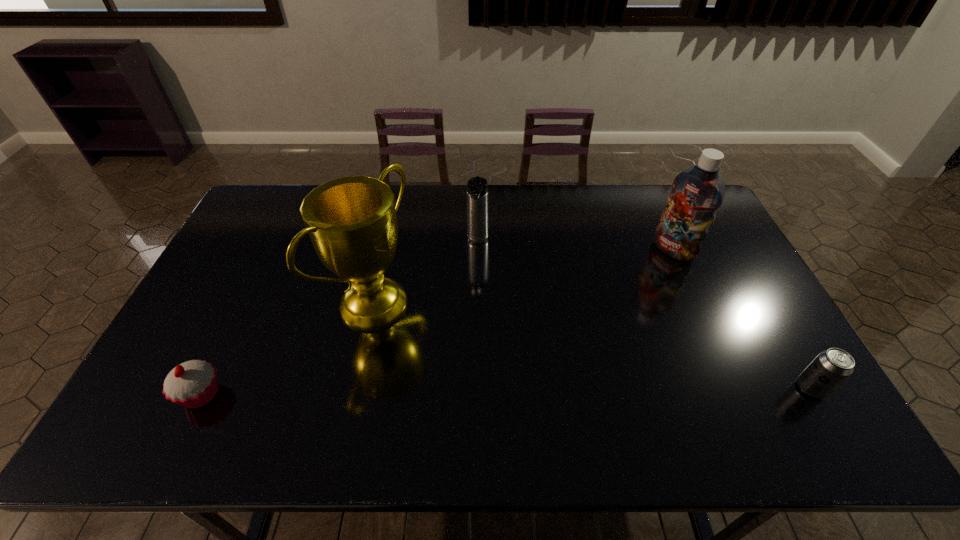
This screenshot has width=960, height=540. I want to click on free spot on the desktop that is between the leftmost object and the rightmost object and is positioned on the front label of the shampoo, so click(497, 391).

Locate an element on the screen. The height and width of the screenshot is (540, 960). free space on the desktop that is between the leftmost object and the rightmost object and is positioned on the handle side of the thermos bottle is located at coordinates (437, 392).

At what (x,y) coordinates should I click in order to perform the action: click on vacant space on the desktop that is between the cupcake and the beer can and is positioned on the shiny surface of the second object from left to right. Please return your answer as a coordinate pair (x, y). The width and height of the screenshot is (960, 540). Looking at the image, I should click on (557, 390).